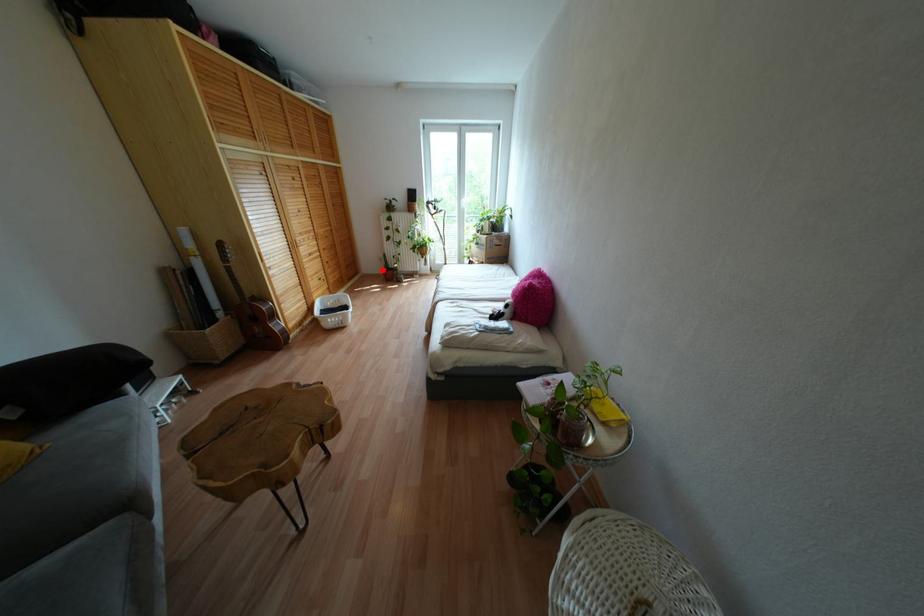
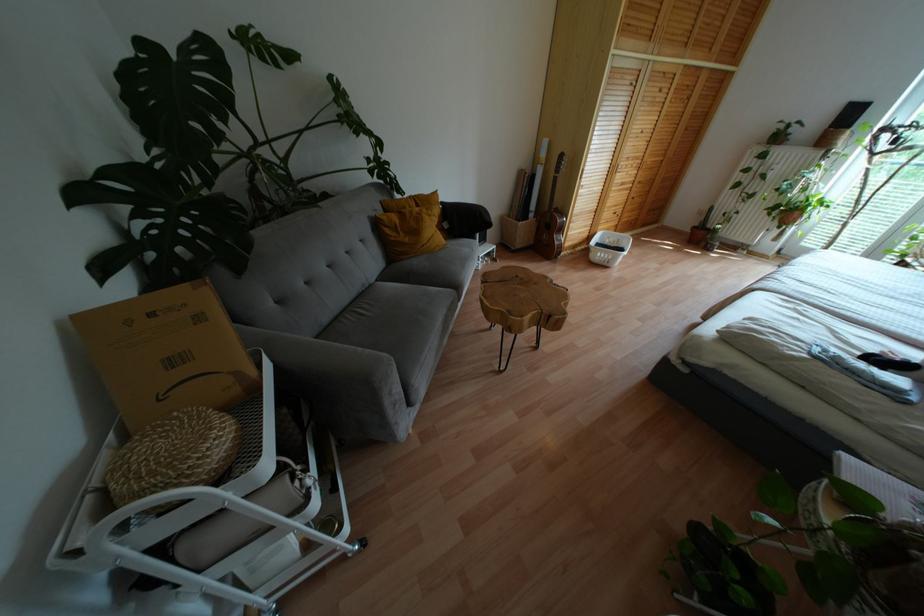
Question: I am providing you with two images of the same scene from different viewpoints. Image1 has a red point marked. In image2, the corresponding 3D location appears at what relative position? Reply with the corresponding letter.

Choices:
 (A) Closer
 (B) Farther

Answer: (A)